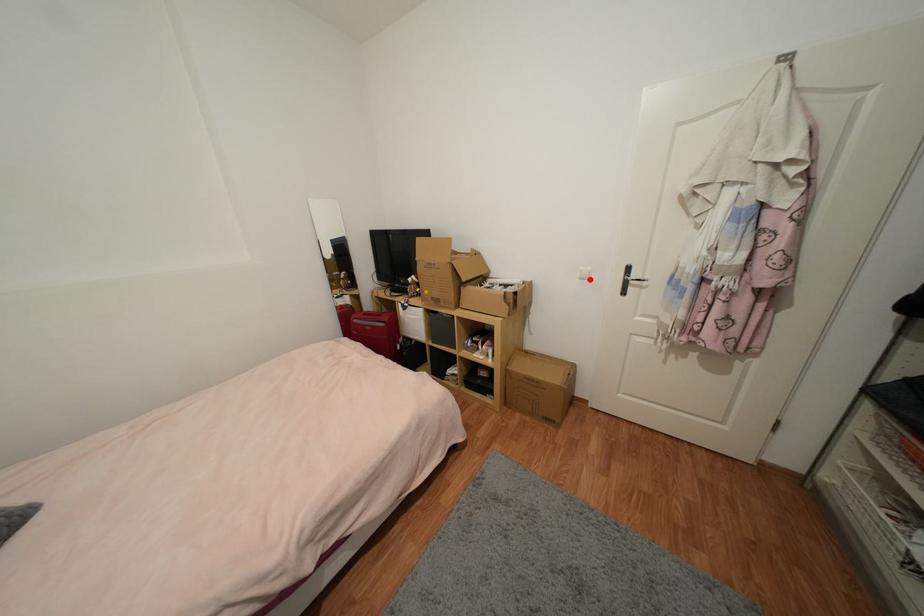
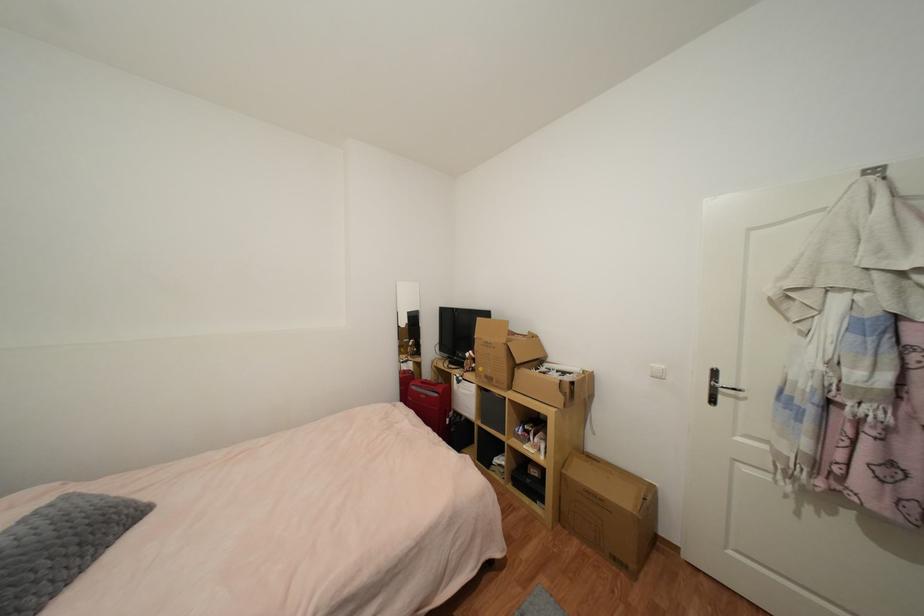
Where in the second image is the point corresponding to the highlighted location from the first image?

(663, 378)